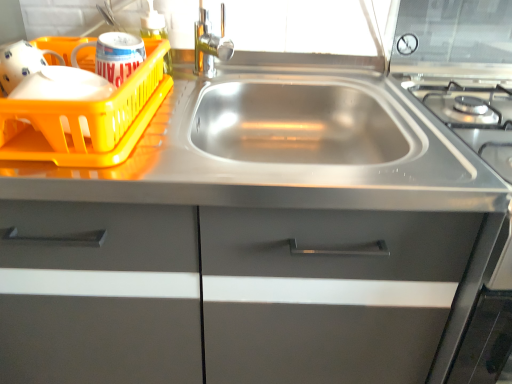
Question: Is yellow plastic basket at left inside or outside of stainless steel sink at center?

Choices:
 (A) outside
 (B) inside

Answer: (A)

Question: Would you say yellow plastic basket at left is to the left or to the right of stainless steel sink at center in the picture?

Choices:
 (A) left
 (B) right

Answer: (A)

Question: Based on their relative distances, which object is nearer to the yellow plastic basket at left?

Choices:
 (A) transparent plastic soap dispenser at upper center
 (B) stainless steel sink at center
 (C) stainless steel sink at center

Answer: (C)

Question: Estimate the real-world distances between objects in this image. Which object is farther from the transparent plastic soap dispenser at upper center?

Choices:
 (A) stainless steel sink at center
 (B) yellow plastic basket at left
 (C) stainless steel sink at center

Answer: (A)